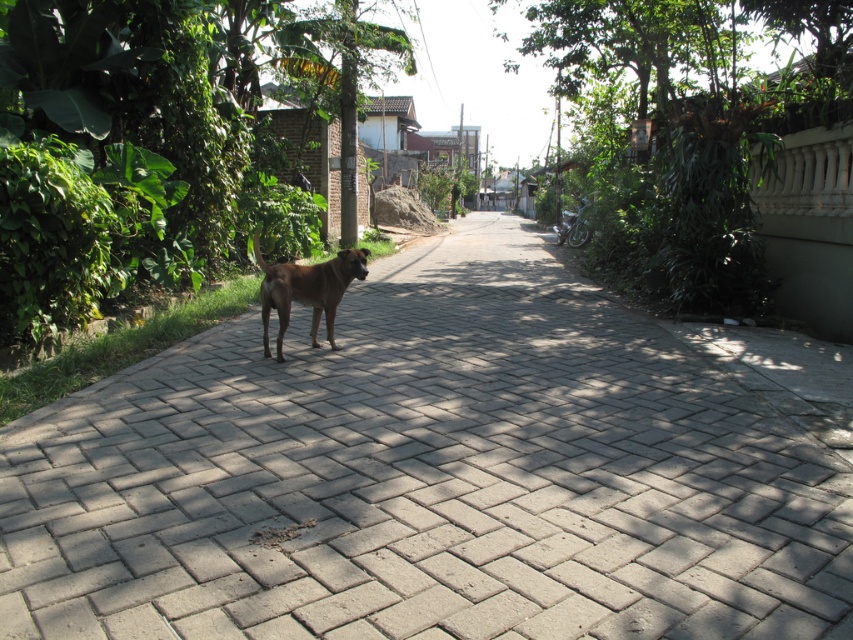
You are a delivery person standing on the gray brick pavement at center. You need to reach the brown furry dog at center to deliver a package. Which direction should you move to approach the dog?

The gray brick pavement at center is to the right of the brown furry dog at center, so you should move to your left to approach the dog.

You are a delivery robot with a 1.5 meter wide package. You need to move from the gray brick pavement at center to the brown furry dog at center. Can you fit through the space between them?

The distance between the gray brick pavement at center and the brown furry dog at center is 1.62 meters. Since the package is 1.5 meters wide, it should fit with some clearance.

You are a delivery drone flying over the gray brick pavement at center and the brown furry dog at center. Which object is higher in elevation?

The gray brick pavement at center is taller than the brown furry dog at center, so the gray brick pavement at center is higher in elevation.